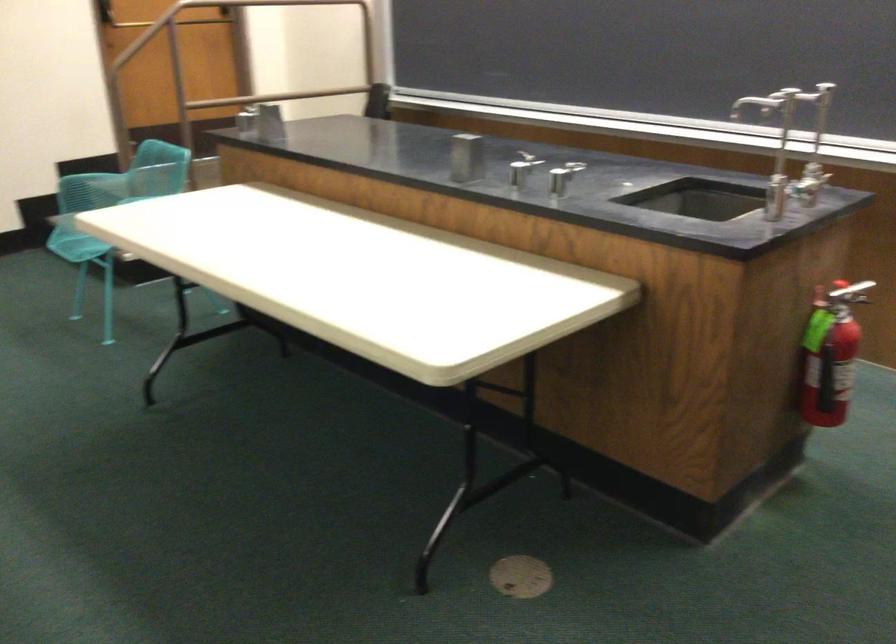
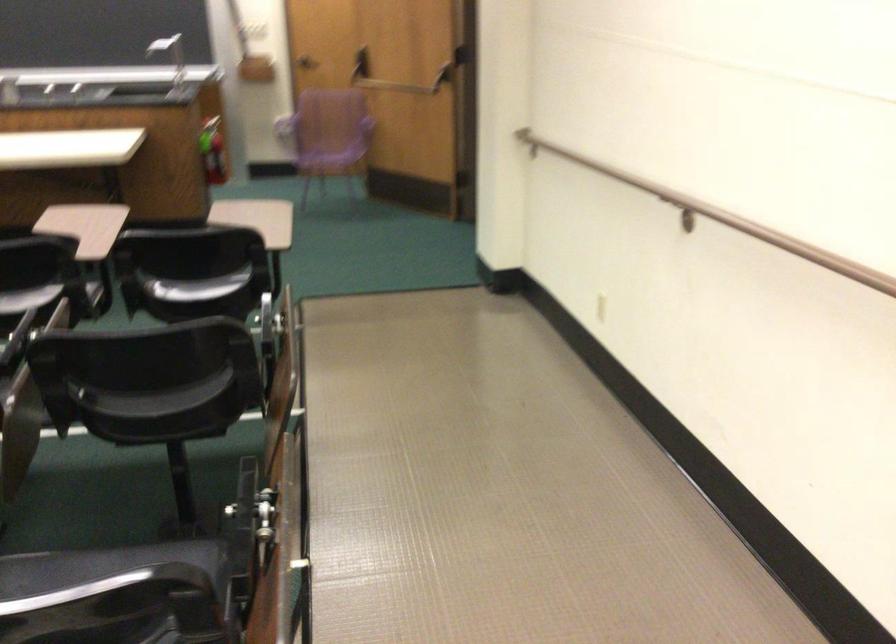
In the second image, find the point that corresponds to pixel 805 355 in the first image.

(212, 151)